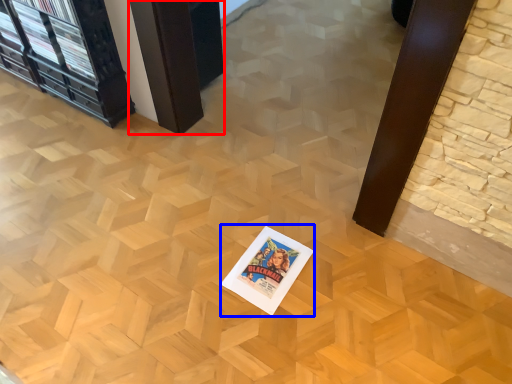
Question: Which object is further to the camera taking this photo, table (highlighted by a red box) or postcard (highlighted by a blue box)?

Choices:
 (A) table
 (B) postcard

Answer: (A)